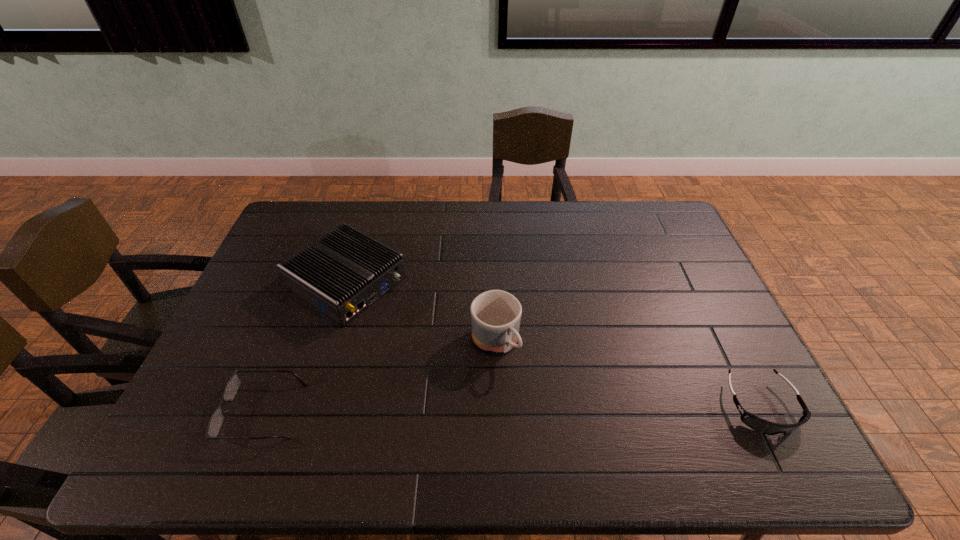
Find the location of `vacant space at the near edge`. vacant space at the near edge is located at coordinates (600, 400).

Find the location of `vacant space at the right edge of the desktop`. vacant space at the right edge of the desktop is located at coordinates (674, 251).

Locate an element on the screen. vacant area that lies between the mug and the third shortest object is located at coordinates (421, 312).

Find the location of `free spot between the rightmost object and the second tallest object`. free spot between the rightmost object and the second tallest object is located at coordinates (554, 344).

Where is `vacant area that lies between the router and the rightmost object`? The height and width of the screenshot is (540, 960). vacant area that lies between the router and the rightmost object is located at coordinates (554, 344).

Find the location of a particular element. vacant area that lies between the shortest object and the third shortest object is located at coordinates (305, 347).

Where is `free spot between the shortest object and the router`? The width and height of the screenshot is (960, 540). free spot between the shortest object and the router is located at coordinates (305, 347).

Identify the location of vacant space in between the third object from left to right and the shortest object. 379,377.

At what (x,y) coordinates should I click in order to perform the action: click on free space between the spectacles and the router. Please return your answer as a coordinate pair (x, y). Looking at the image, I should click on point(305,347).

You are a GUI agent. You are given a task and a screenshot of the screen. Output one action in this format:
    pyautogui.click(x=<x>, y=<y>)
    Task: Click on the vacant area between the router and the shortest object
    
    Given the screenshot: What is the action you would take?
    pyautogui.click(x=305, y=347)